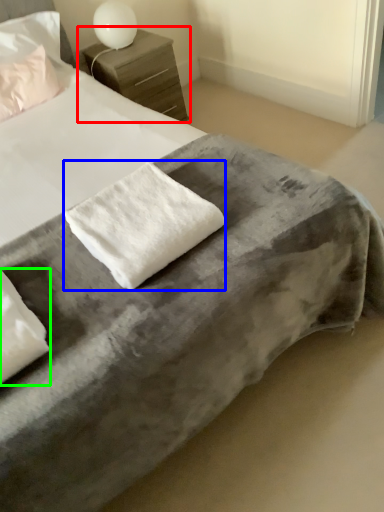
Question: Estimate the real-world distances between objects in this image. Which object is farther from nightstand (highlighted by a red box), cloth (highlighted by a blue box) or pillow (highlighted by a green box)?

Choices:
 (A) cloth
 (B) pillow

Answer: (B)